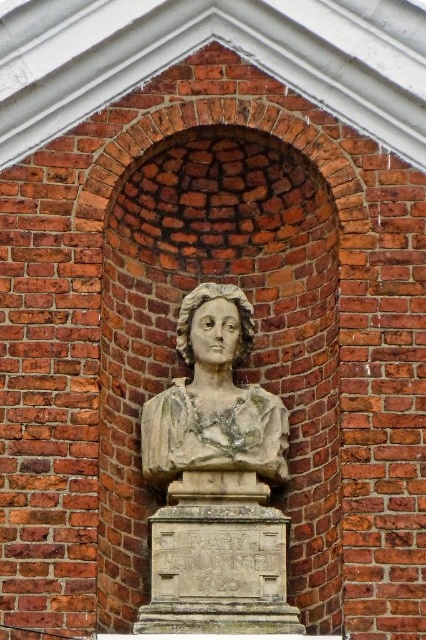
Which is more to the right, stone bust at center or stone statue at center?

Positioned to the right is stone bust at center.

Looking at this image, can you confirm if stone bust at center is shorter than stone statue at center?

No.

Identify the location of stone bust at center. The height and width of the screenshot is (640, 426). (213, 397).